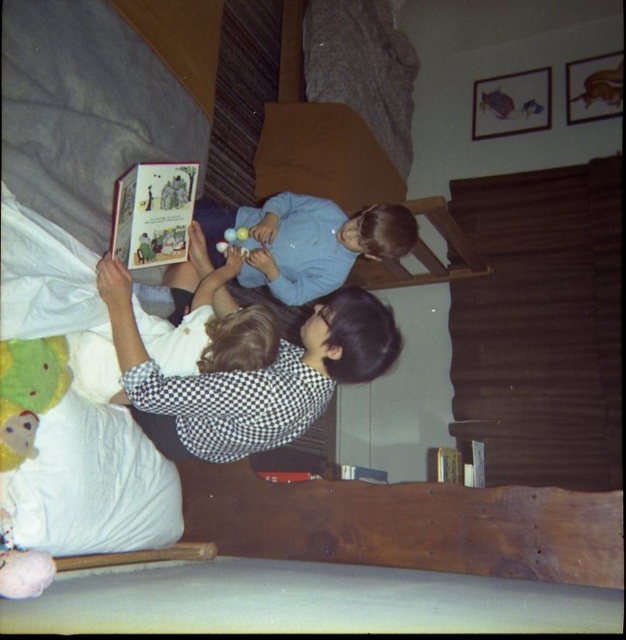
Question: Which of the following is the farthest from the observer?

Choices:
 (A) checkered fabric shirt at center
 (B) green plush mouse at lower left
 (C) hardcover book at center

Answer: (C)

Question: Is light blue fabric at center thinner than hardcover book at center?

Choices:
 (A) yes
 (B) no

Answer: (B)

Question: Which point is farther to the camera?

Choices:
 (A) green plush mouse at lower left
 (B) checkered fabric shirt at center
 (C) light blue fabric at center

Answer: (C)

Question: Which point is closer to the camera?

Choices:
 (A) hardcover book at center
 (B) checkered fabric shirt at center
 (C) light blue fabric at center

Answer: (B)

Question: Can you confirm if light blue fabric at center is bigger than green plush mouse at lower left?

Choices:
 (A) no
 (B) yes

Answer: (B)

Question: Is checkered fabric shirt at center to the left of light blue fabric at center from the viewer's perspective?

Choices:
 (A) yes
 (B) no

Answer: (A)